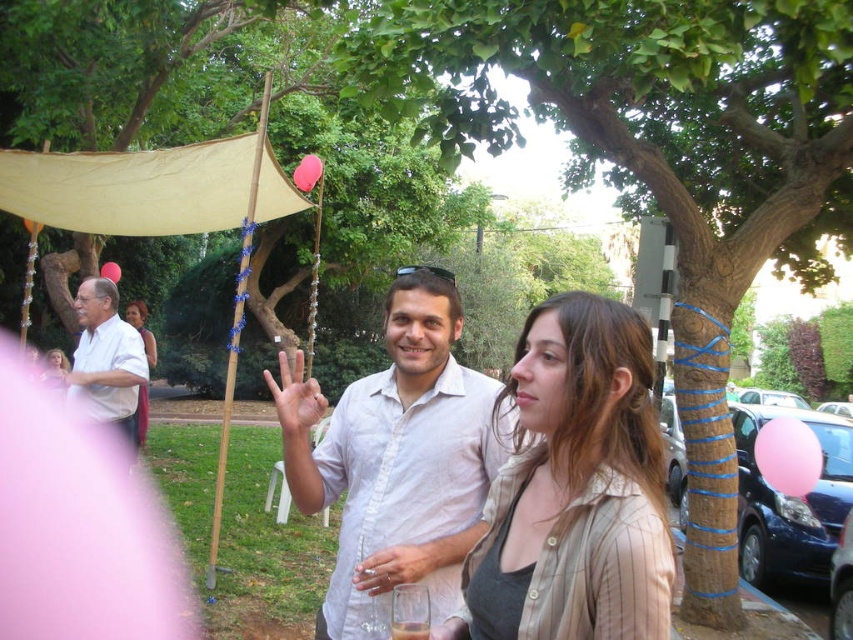
Question: Which point is closer to the camera taking this photo?

Choices:
 (A) (817, 454)
 (B) (138, 429)
 (C) (315, 156)

Answer: (A)

Question: Can you confirm if white cotton shirt at center is positioned below matte pink scarf at center?

Choices:
 (A) no
 (B) yes

Answer: (B)

Question: Which object is the farthest from the pink latex balloon at upper center?

Choices:
 (A) pink rubber balloon at upper left
 (B) brown textured tree at center
 (C) white matte shirt at left

Answer: (B)

Question: Which object is farther from the camera taking this photo?

Choices:
 (A) matte pink scarf at center
 (B) pink matte balloon at upper center
 (C) pink rubber balloon at center

Answer: (A)

Question: Does white matte shirt at left have a lesser width compared to pink latex balloon at upper center?

Choices:
 (A) no
 (B) yes

Answer: (B)

Question: Can you confirm if pink rubber balloon at center is positioned below pink matte balloon at upper center?

Choices:
 (A) yes
 (B) no

Answer: (A)